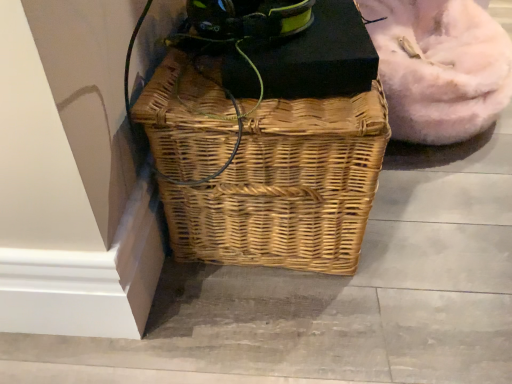
Where is `free space in front of natural wicker picnic basket at center`? free space in front of natural wicker picnic basket at center is located at coordinates (322, 330).